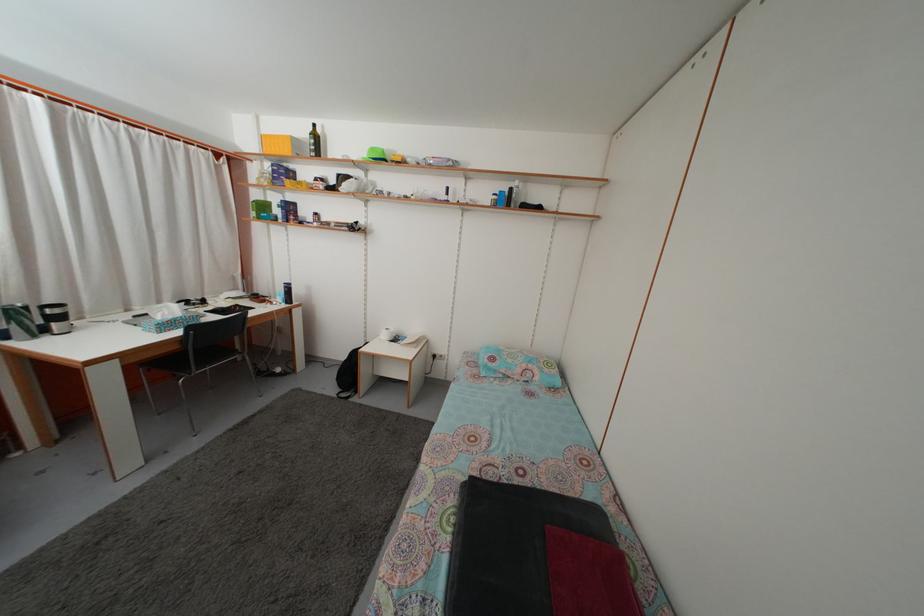
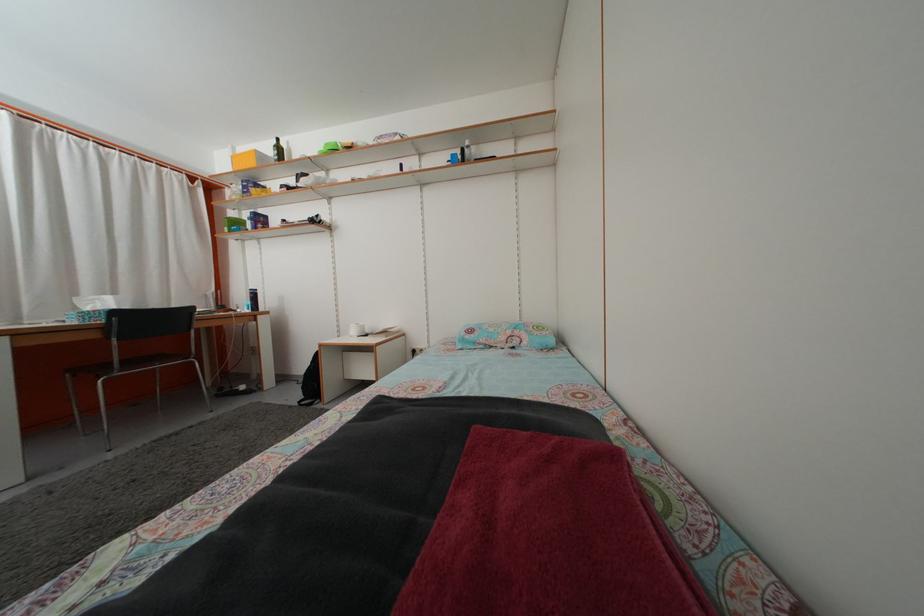
In the second image, find the point that corresponds to (525,378) in the first image.

(508, 346)